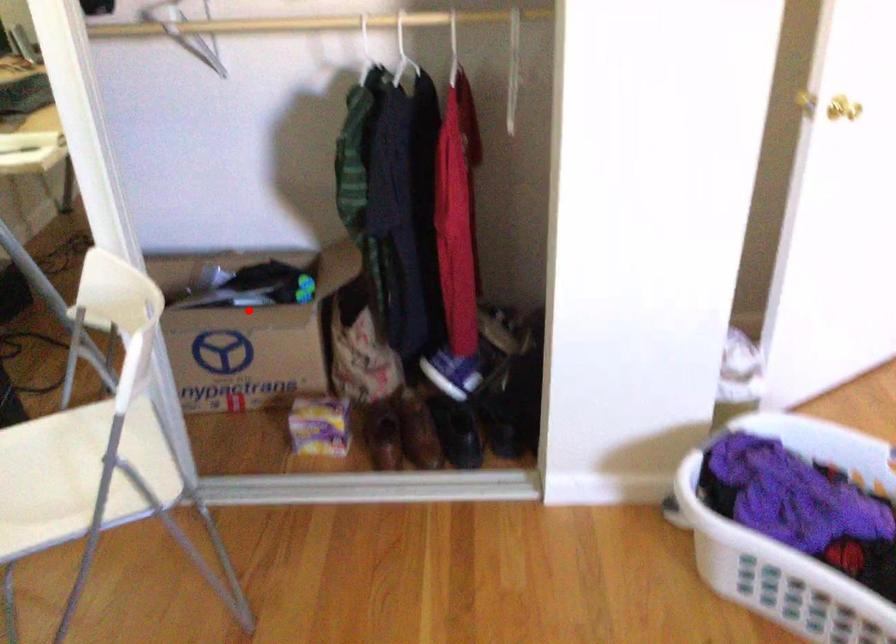
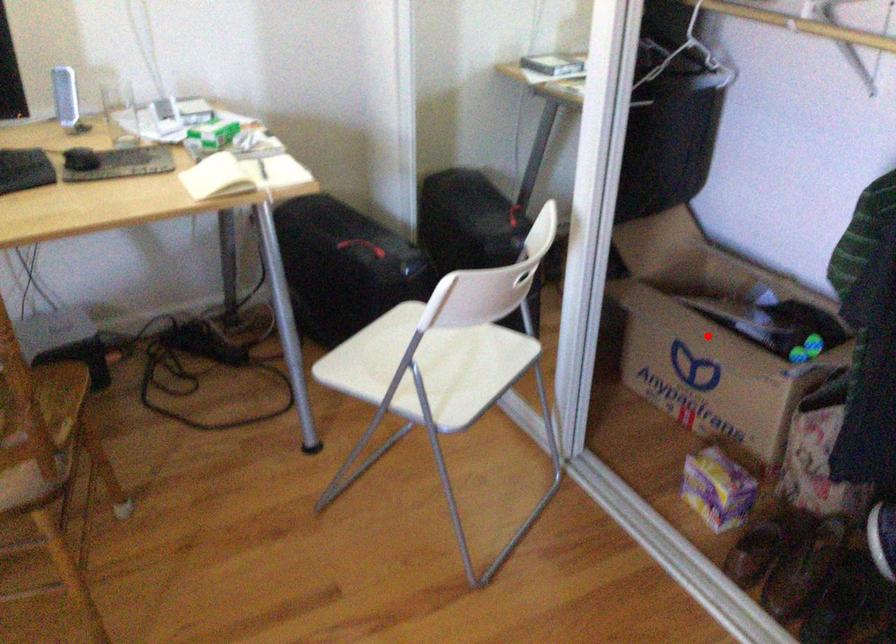
I am providing you with two images of the same scene from different viewpoints. A red point is marked on the first image and another point is marked on the second image. Are the points marked in image1 and image2 representing the same 3D position?

Yes